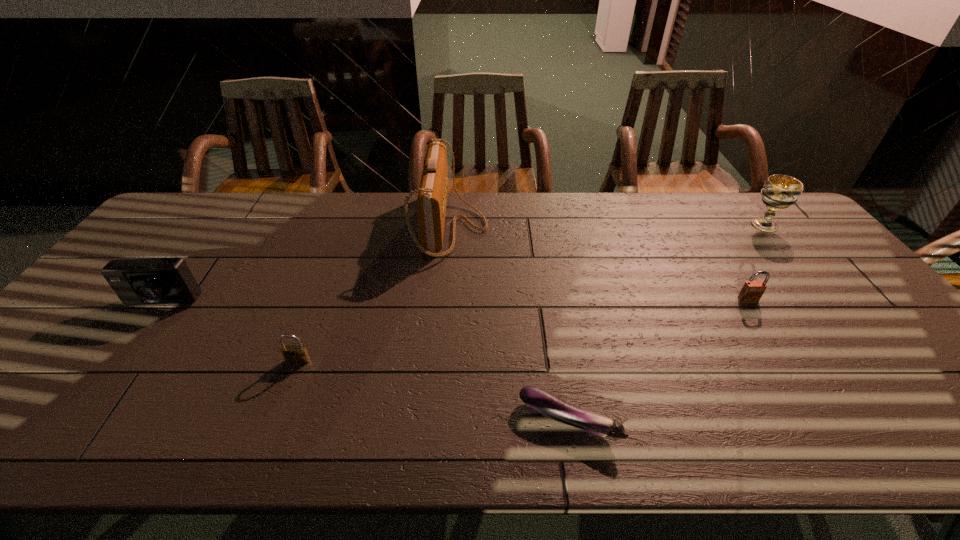
Locate an element on the screen. The height and width of the screenshot is (540, 960). the nearest object is located at coordinates (544, 402).

Identify the location of the shortest object. (544, 402).

The height and width of the screenshot is (540, 960). Identify the location of free space located 0.400m on the decorative side of the tallest object. (608, 226).

You are a GUI agent. You are given a task and a screenshot of the screen. Output one action in this format:
    pyautogui.click(x=<x>, y=<y>)
    Task: Click on the vacant space located 0.400m on the left of the chalice
    The image size is (960, 540).
    Given the screenshot: What is the action you would take?
    pyautogui.click(x=628, y=225)

This screenshot has height=540, width=960. I want to click on free space located on the front-facing side of the third tallest object, so click(53, 449).

What are the coordinates of `vacant space located 0.160m on the front-facing side of the farther padlock` in the screenshot? It's located at (780, 348).

Find the location of a particular element. vacant space located on the front-facing side of the fifth object from right to left is located at coordinates (276, 417).

You are a GUI agent. You are given a task and a screenshot of the screen. Output one action in this format:
    pyautogui.click(x=<x>, y=<y>)
    Task: Click on the vacant region located on the left of the third object from right to left
    This screenshot has height=540, width=960.
    Given the screenshot: What is the action you would take?
    pyautogui.click(x=383, y=421)

This screenshot has width=960, height=540. I want to click on handbag that is positioned at the far edge, so click(x=432, y=198).

This screenshot has height=540, width=960. What are the coordinates of `chalice that is at the far edge` in the screenshot? It's located at coord(779,192).